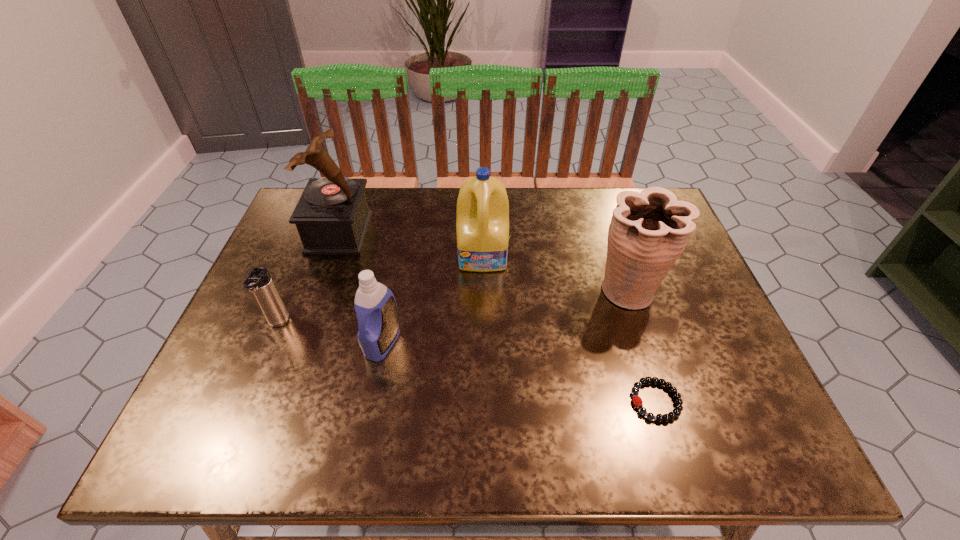
Where is `the tallest object`? the tallest object is located at coordinates (332, 216).

This screenshot has width=960, height=540. I want to click on the taller detergent, so click(482, 226).

The width and height of the screenshot is (960, 540). I want to click on the farther detergent, so click(482, 226).

Identify the location of urn. The image size is (960, 540). (649, 230).

This screenshot has height=540, width=960. I want to click on the fourth tallest object, so click(375, 305).

The image size is (960, 540). I want to click on the nearer detergent, so click(375, 305).

Find the location of a particular element. The height and width of the screenshot is (540, 960). thermos bottle is located at coordinates tap(258, 281).

Image resolution: width=960 pixels, height=540 pixels. What are the coordinates of `bracelet` in the screenshot? It's located at (676, 412).

The height and width of the screenshot is (540, 960). I want to click on the shortest object, so click(x=676, y=412).

Identify the location of free space located at the horn opening of the tallest object. (499, 232).